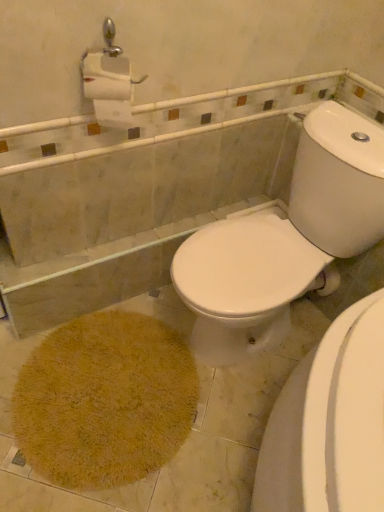
Describe the element at coordinates (105, 400) in the screenshot. I see `yellow shaggy bath mat at lower left` at that location.

The width and height of the screenshot is (384, 512). I want to click on yellow shaggy bath mat at lower left, so click(x=105, y=400).

This screenshot has height=512, width=384. I want to click on white glossy toilet at center, so click(285, 241).

This screenshot has width=384, height=512. Describe the element at coordinates (285, 241) in the screenshot. I see `white glossy toilet at center` at that location.

Measure the distance between white glossy toilet at center and camera.

white glossy toilet at center and camera are 3.63 feet apart.

Image resolution: width=384 pixels, height=512 pixels. I want to click on yellow shaggy bath mat at lower left, so click(x=105, y=400).

Which is more to the right, white glossy toilet at center or yellow shaggy bath mat at lower left?

From the viewer's perspective, white glossy toilet at center appears more on the right side.

From the picture: Is white glossy toilet at center behind yellow shaggy bath mat at lower left?

No, white glossy toilet at center is closer to the camera.

Is point (225, 242) positioned behind point (85, 400)?

No, it is not.

From the image's perspective, which object appears higher, white glossy toilet at center or yellow shaggy bath mat at lower left?

white glossy toilet at center appears higher in the image.

Based on the photo, from a real-world perspective, relative to yellow shaggy bath mat at lower left, is white glossy toilet at center vertically above or below?

Clearly, from a real-world perspective, white glossy toilet at center is above yellow shaggy bath mat at lower left.

Considering the relative sizes of white glossy toilet at center and yellow shaggy bath mat at lower left in the image provided, is white glossy toilet at center thinner than yellow shaggy bath mat at lower left?

No, white glossy toilet at center is not thinner than yellow shaggy bath mat at lower left.

From their relative heights in the image, would you say white glossy toilet at center is taller or shorter than yellow shaggy bath mat at lower left?

In the image, white glossy toilet at center appears to be taller than yellow shaggy bath mat at lower left.

Does white glossy toilet at center have a smaller size compared to yellow shaggy bath mat at lower left?

Actually, white glossy toilet at center might be larger than yellow shaggy bath mat at lower left.

Can we say white glossy toilet at center lies outside yellow shaggy bath mat at lower left?

That's correct, white glossy toilet at center is outside of yellow shaggy bath mat at lower left.

Is the surface of white glossy toilet at center in direct contact with yellow shaggy bath mat at lower left?

There is a gap between white glossy toilet at center and yellow shaggy bath mat at lower left.

Is white glossy toilet at center facing away from yellow shaggy bath mat at lower left?

white glossy toilet at center is not turned away from yellow shaggy bath mat at lower left.

Can you tell me how much white glossy toilet at center and yellow shaggy bath mat at lower left differ in facing direction?

white glossy toilet at center and yellow shaggy bath mat at lower left are facing 0.000141 degrees away from each other.

Identify the location of bath mat behind the white glossy toilet at center. (105, 400).

Which is more to the left, yellow shaggy bath mat at lower left or white glossy toilet at center?

yellow shaggy bath mat at lower left is more to the left.

Between yellow shaggy bath mat at lower left and white glossy toilet at center, which one is positioned behind?

Positioned behind is yellow shaggy bath mat at lower left.

Considering the positions of points (161, 404) and (260, 233), is point (161, 404) closer to camera compared to point (260, 233)?

No, (161, 404) is further to viewer.

From the image's perspective, is yellow shaggy bath mat at lower left over white glossy toilet at center?

Incorrect, from the image's perspective, yellow shaggy bath mat at lower left is lower than white glossy toilet at center.

From a real-world perspective, who is located higher, yellow shaggy bath mat at lower left or white glossy toilet at center?

From a 3D spatial view, white glossy toilet at center is above.

In terms of width, does yellow shaggy bath mat at lower left look wider or thinner when compared to white glossy toilet at center?

yellow shaggy bath mat at lower left is thinner than white glossy toilet at center.

Considering the sizes of objects yellow shaggy bath mat at lower left and white glossy toilet at center in the image provided, who is taller, yellow shaggy bath mat at lower left or white glossy toilet at center?

white glossy toilet at center.

Considering the sizes of objects yellow shaggy bath mat at lower left and white glossy toilet at center in the image provided, who is bigger, yellow shaggy bath mat at lower left or white glossy toilet at center?

With larger size is white glossy toilet at center.

Is yellow shaggy bath mat at lower left inside or outside of white glossy toilet at center?

yellow shaggy bath mat at lower left is outside white glossy toilet at center.

Is yellow shaggy bath mat at lower left in contact with white glossy toilet at center?

No, yellow shaggy bath mat at lower left is not in contact with white glossy toilet at center.

Is yellow shaggy bath mat at lower left positioned with its back to white glossy toilet at center?

Yes, yellow shaggy bath mat at lower left is positioned with its back facing white glossy toilet at center.

What's the angular difference between yellow shaggy bath mat at lower left and white glossy toilet at center's facing directions?

The facing directions of yellow shaggy bath mat at lower left and white glossy toilet at center are 0.000141 degrees apart.

At what (x,y) coordinates should I click in order to perform the action: click on bath mat below the white glossy toilet at center (from the image's perspective). Please return your answer as a coordinate pair (x, y). The image size is (384, 512). Looking at the image, I should click on (105, 400).

Find the location of `toilet in front of the yellow shaggy bath mat at lower left`. toilet in front of the yellow shaggy bath mat at lower left is located at coordinates (285, 241).

You are a GUI agent. You are given a task and a screenshot of the screen. Output one action in this format:
    pyautogui.click(x=<x>, y=<y>)
    Task: Click on the bath mat below the white glossy toilet at center (from a real-world perspective)
    This screenshot has height=512, width=384.
    Given the screenshot: What is the action you would take?
    pyautogui.click(x=105, y=400)